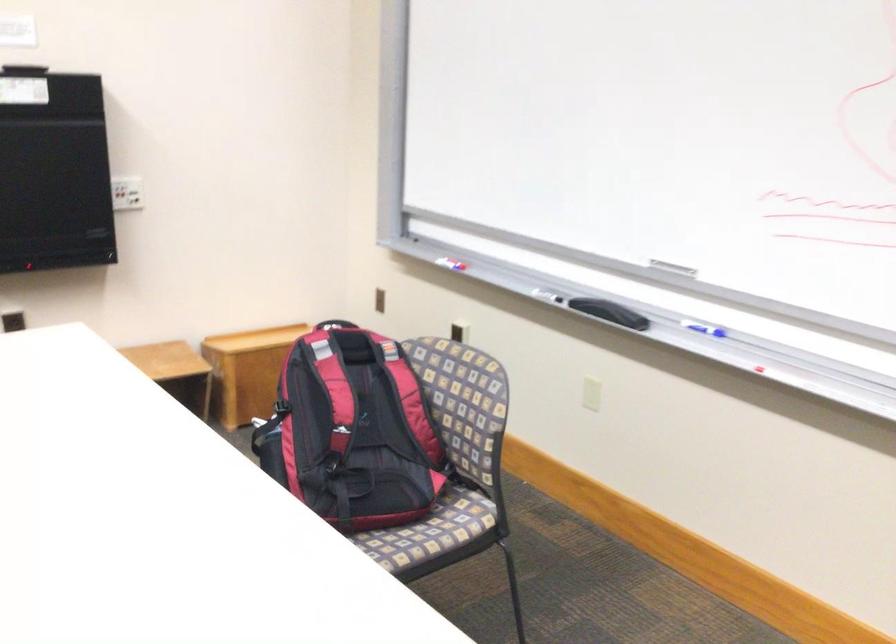
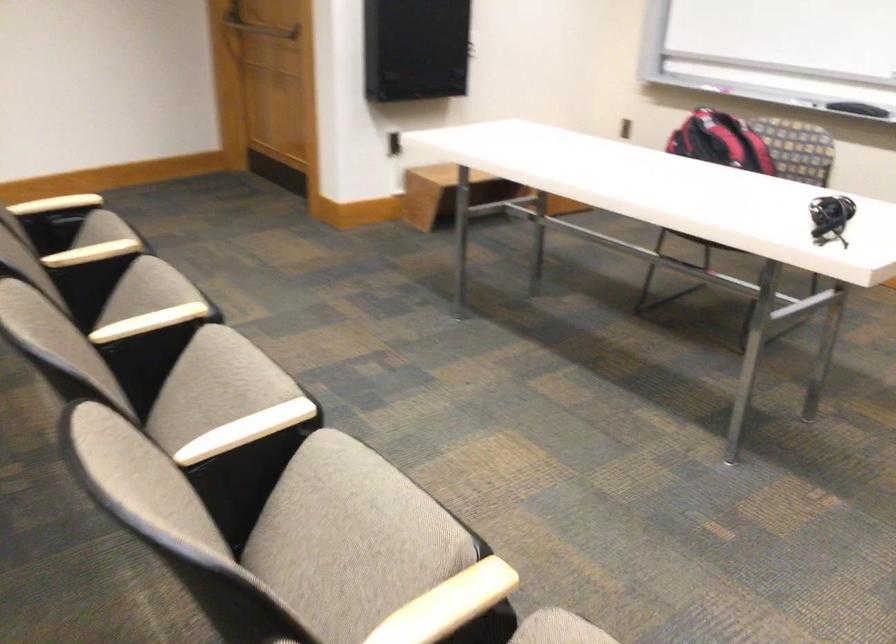
Question: I am providing you with two images of the same scene from different viewpoints. Which of the following objects are not visible in image2?

Choices:
 (A) red and black backpack
 (B) small wooden box
 (C) tan book
 (D) chair sitting surface

Answer: (B)